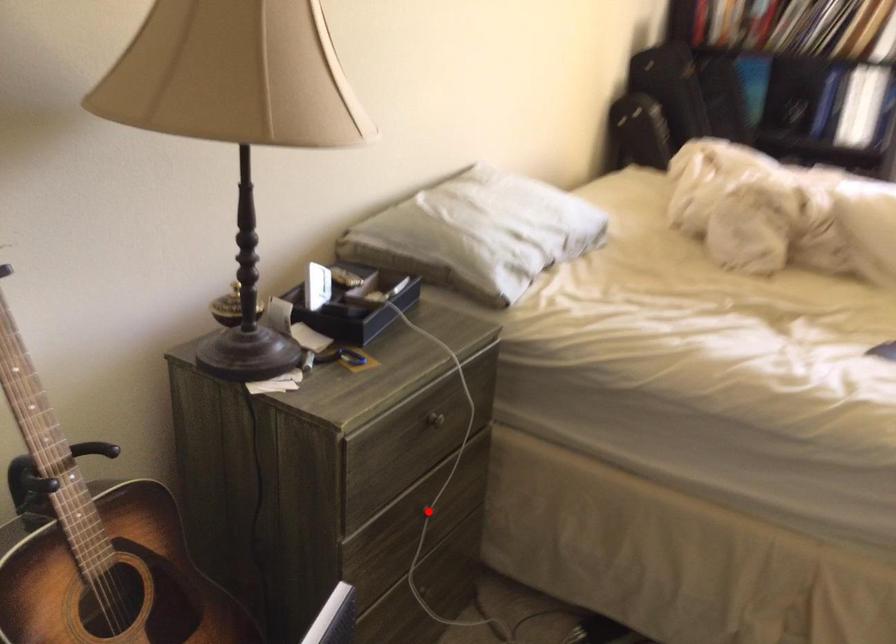
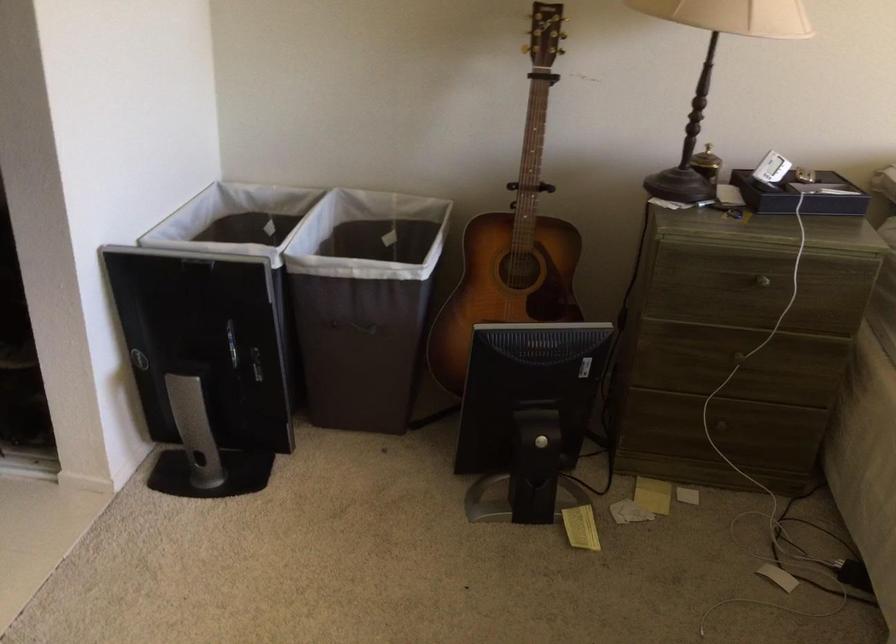
Question: I am providing you with two images of the same scene from different viewpoints. Given a red point in image1, look at the same physical point in image2. Is it:

Choices:
 (A) Closer to the viewpoint
 (B) Farther from the viewpoint

Answer: (B)